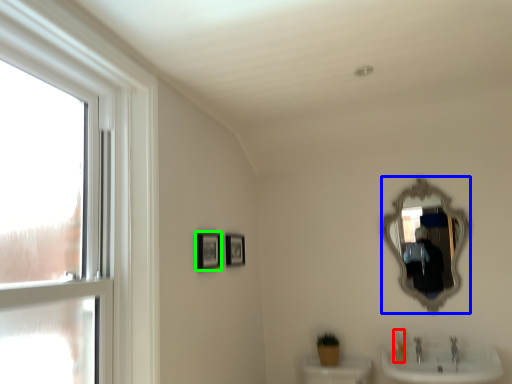
Question: Based on their relative distances, which object is nearer to toiletry (highlighted by a red box)? Choose from mirror (highlighted by a blue box) and picture frame (highlighted by a green box).

Choices:
 (A) mirror
 (B) picture frame

Answer: (A)